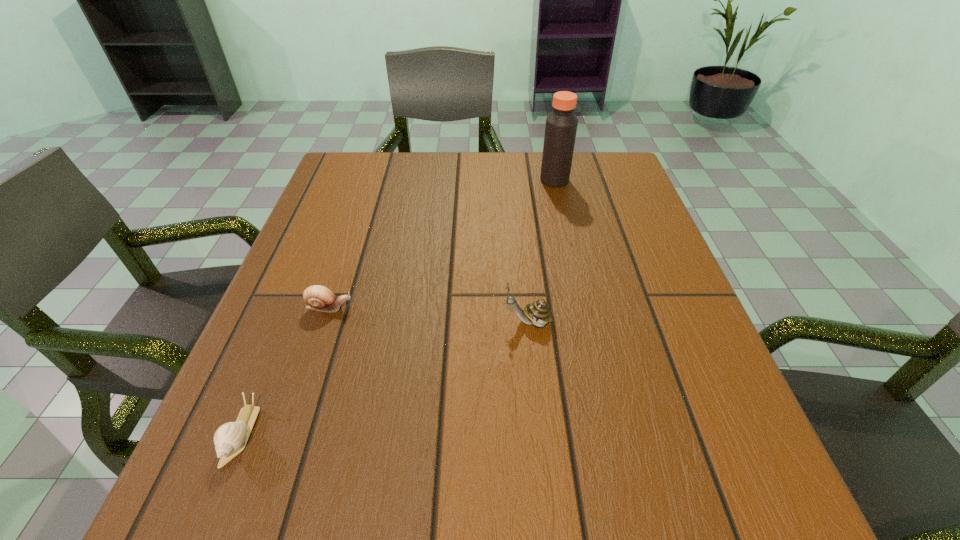
Where is `vacant area located 0.260m on the face of the tallest escargot`? vacant area located 0.260m on the face of the tallest escargot is located at coordinates (359, 322).

The height and width of the screenshot is (540, 960). In order to click on vacant region located on the face of the tallest escargot in this screenshot , I will do [393, 322].

Where is `blank space located on the front-facing side of the second escargot from right to left`? blank space located on the front-facing side of the second escargot from right to left is located at coordinates (487, 307).

Locate an element on the screen. This screenshot has width=960, height=540. object present at the far edge is located at coordinates (561, 125).

This screenshot has width=960, height=540. Identify the location of object that is positioned at the near edge. (230, 439).

This screenshot has width=960, height=540. Find the location of `object located at the near left corner`. object located at the near left corner is located at coordinates (230, 439).

This screenshot has height=540, width=960. Identify the location of free location at the far edge of the desktop. (454, 193).

You are a GUI agent. You are given a task and a screenshot of the screen. Output one action in this format:
    pyautogui.click(x=<x>, y=<y>)
    Task: Click on the free space at the near edge of the desktop
    
    Given the screenshot: What is the action you would take?
    pyautogui.click(x=349, y=465)

At what (x,y) coordinates should I click in order to perform the action: click on free region at the left edge of the desktop. Please return your answer as a coordinate pair (x, y). Image resolution: width=960 pixels, height=540 pixels. Looking at the image, I should click on (324, 329).

You are a GUI agent. You are given a task and a screenshot of the screen. Output one action in this format:
    pyautogui.click(x=<x>, y=<y>)
    Task: Click on the free space at the right edge of the desktop
    This screenshot has width=960, height=540.
    Given the screenshot: What is the action you would take?
    pyautogui.click(x=603, y=284)